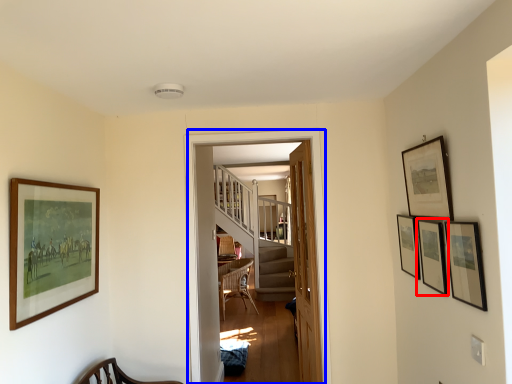
Question: Which point is closer to the camera, picture frame (highlighted by a red box) or corridor (highlighted by a blue box)?

Choices:
 (A) picture frame
 (B) corridor

Answer: (A)